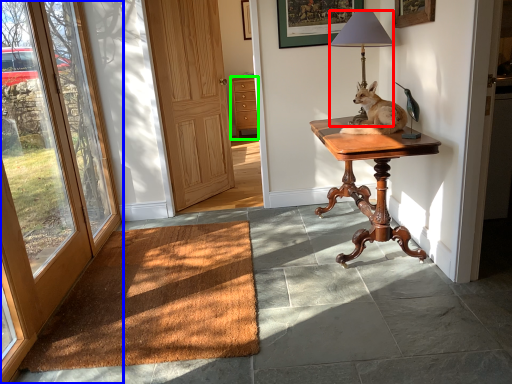
Question: Estimate the real-world distances between objects in this image. Which object is farther from lamp (highlighted by a red box), door (highlighted by a blue box) or cabinetry (highlighted by a green box)?

Choices:
 (A) door
 (B) cabinetry

Answer: (B)